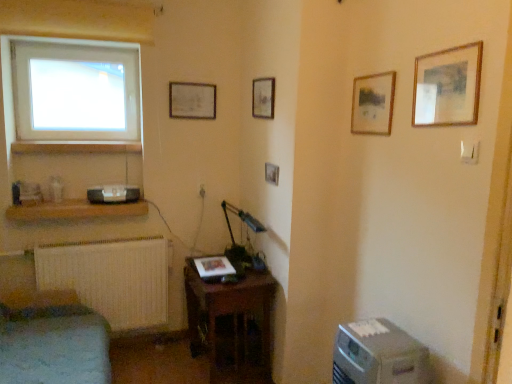
In order to face metallic gray table lamp at lower center, should I rotate leftwards or rightwards?

To align with it, rotate left about 1.421°.

This screenshot has width=512, height=384. What do you see at coordinates (241, 220) in the screenshot?
I see `metallic gray table lamp at lower center` at bounding box center [241, 220].

What do you see at coordinates (113, 194) in the screenshot?
I see `matte black speaker at lower left` at bounding box center [113, 194].

This screenshot has height=384, width=512. I want to click on wooden picture frame at upper right, the 5th picture frame from the back, so click(x=447, y=86).

At what (x,y) coordinates should I click in order to perform the action: click on white matte radiator at lower left. Please return your answer as a coordinate pair (x, y). This screenshot has height=384, width=512. Looking at the image, I should click on (111, 278).

Where is `wooden shelf at lower left, the 2th shelf in the top-to-bottom sequence`? This screenshot has width=512, height=384. wooden shelf at lower left, the 2th shelf in the top-to-bottom sequence is located at coordinates (75, 210).

Where is `transparent glass window at upper left`? transparent glass window at upper left is located at coordinates (75, 91).

I want to click on white plastic electric outlet at center, so click(202, 191).

From a real-world perspective, does metallic gray desktop computer at lower right stand above white plastic electric outlet at center?

No, from a real-world perspective, metallic gray desktop computer at lower right is not above white plastic electric outlet at center.

In the image, is metallic gray desktop computer at lower right positioned in front of or behind white plastic electric outlet at center?

metallic gray desktop computer at lower right is positioned closer to the viewer than white plastic electric outlet at center.

Considering the sizes of objects metallic gray desktop computer at lower right and white plastic electric outlet at center in the image provided, who is taller, metallic gray desktop computer at lower right or white plastic electric outlet at center?

With more height is metallic gray desktop computer at lower right.

Are metallic gray desktop computer at lower right and white plastic electric outlet at center making contact?

No, metallic gray desktop computer at lower right is not making contact with white plastic electric outlet at center.

Can you confirm if wooden picture frame at center, arranged as the 4th picture frame when viewed from the front, is bigger than wooden shelf at lower left, the 2th shelf in the top-to-bottom sequence?

Actually, wooden picture frame at center, arranged as the 4th picture frame when viewed from the front, might be smaller than wooden shelf at lower left, the 2th shelf in the top-to-bottom sequence.

Is wooden shelf at lower left, the 2th shelf in the top-to-bottom sequence, located within wooden picture frame at center, the second picture frame when ordered from back to front?

Definitely not — wooden shelf at lower left, the 2th shelf in the top-to-bottom sequence, is not inside wooden picture frame at center, the second picture frame when ordered from back to front.

Considering the positions of point (257, 105) and point (132, 204), is point (257, 105) closer or farther from the camera than point (132, 204)?

Point (257, 105) is positioned closer to the camera compared to point (132, 204).

Is wooden picture frame at center, which is counted as the 4th picture frame, starting from the right, oriented away from wooden shelf at lower left, positioned as the first shelf in bottom-to-top order?

No.

Is matte black speaker at lower left with wooden picture frame at center, the third picture frame from the right?

No, matte black speaker at lower left is not next to wooden picture frame at center, the third picture frame from the right.

Is matte black speaker at lower left oriented away from wooden picture frame at center, the third picture frame when ordered from back to front?

No.

Which is less distant, [91,196] or [270,169]?

Point [91,196] is farther from the camera than point [270,169].

From the image's perspective, is matte black speaker at lower left above or below wooden picture frame at center, which is the third picture frame from front to back?

Clearly, from the image's perspective, matte black speaker at lower left is below wooden picture frame at center, which is the third picture frame from front to back.

From a real-world perspective, between wooden picture frame at center, the third picture frame when ordered from back to front, and wooden picture frame at upper right, the first picture frame viewed from the right, who is vertically higher?

wooden picture frame at upper right, the first picture frame viewed from the right, is physically above.

Considering the positions of objects wooden picture frame at center, which is the third picture frame from front to back, and wooden picture frame at upper right, the 5th picture frame from the back, in the image provided, who is more to the left, wooden picture frame at center, which is the third picture frame from front to back, or wooden picture frame at upper right, the 5th picture frame from the back,?

wooden picture frame at center, which is the third picture frame from front to back.

Is wooden picture frame at center, the 3th picture frame viewed from the left, shorter than wooden picture frame at upper right, the first picture frame viewed from the right?

Indeed, wooden picture frame at center, the 3th picture frame viewed from the left, has a lesser height compared to wooden picture frame at upper right, the first picture frame viewed from the right.

Considering the relative sizes of wooden picture frame at upper right, the 5th picture frame from the back, and white matte radiator at lower left in the image provided, is wooden picture frame at upper right, the 5th picture frame from the back, smaller than white matte radiator at lower left?

Correct, wooden picture frame at upper right, the 5th picture frame from the back, occupies less space than white matte radiator at lower left.

From a real-world perspective, between wooden picture frame at upper right, the 5th picture frame from the back, and white matte radiator at lower left, who is vertically higher?

From a 3D spatial view, wooden picture frame at upper right, the 5th picture frame from the back, is above.

Considering the relative positions of wooden picture frame at upper right, the 1th picture frame from the front, and white matte radiator at lower left in the image provided, is wooden picture frame at upper right, the 1th picture frame from the front, to the right of white matte radiator at lower left from the viewer's perspective?

Correct, you'll find wooden picture frame at upper right, the 1th picture frame from the front, to the right of white matte radiator at lower left.

From the image's perspective, between wooden picture frame at upper right, the first picture frame viewed from the right, and white matte radiator at lower left, which one is located above?

wooden picture frame at upper right, the first picture frame viewed from the right, is shown above in the image.

Which of these two, velvet green sofa at lower left or wooden shelf at lower left, positioned as the first shelf in bottom-to-top order, is bigger?

velvet green sofa at lower left is bigger.

Which is behind, point (80, 315) or point (78, 208)?

The point (78, 208) is farther from the camera.

Is velvet green sofa at lower left oriented away from wooden shelf at lower left, positioned as the first shelf in bottom-to-top order?

No, velvet green sofa at lower left's orientation is not away from wooden shelf at lower left, positioned as the first shelf in bottom-to-top order.

From a real-world perspective, is velvet green sofa at lower left physically located above or below wooden shelf at lower left, positioned as the first shelf in bottom-to-top order?

Clearly, from a real-world perspective, velvet green sofa at lower left is below wooden shelf at lower left, positioned as the first shelf in bottom-to-top order.

Is white matte radiator at lower left behind wooden framed picture at upper right, the 4th picture frame when ordered from back to front?

Yes, white matte radiator at lower left is further from the camera.

Is white matte radiator at lower left at the right side of wooden framed picture at upper right, the 4th picture frame when ordered from back to front?

No.

Is white matte radiator at lower left facing away from wooden framed picture at upper right, the 4th picture frame when ordered from back to front?

No, white matte radiator at lower left is not facing away from wooden framed picture at upper right, the 4th picture frame when ordered from back to front.

How different are the orientations of white matte radiator at lower left and wooden framed picture at upper right, the 4th picture frame when ordered from back to front, in degrees?

92.2 degrees separate the facing orientations of white matte radiator at lower left and wooden framed picture at upper right, the 4th picture frame when ordered from back to front.

Image resolution: width=512 pixels, height=384 pixels. I want to click on desktop computer below the white plastic electric outlet at center (from a real-world perspective), so point(378,355).

Where is `the 2nd picture frame to the right of the wooden shelf at lower left, the 2th shelf in the top-to-bottom sequence, counting from the anchor's position`? The image size is (512, 384). the 2nd picture frame to the right of the wooden shelf at lower left, the 2th shelf in the top-to-bottom sequence, counting from the anchor's position is located at coordinates (263, 98).

Estimate the real-world distances between objects in this image. Which object is further from wooden picture frame at center, the third picture frame from the right, white plastic electric outlet at center or transparent glass window at upper left?

transparent glass window at upper left is positioned further to the anchor wooden picture frame at center, the third picture frame from the right.

Looking at the image, which one is located closer to wooden framed picture at upper right, which is the second picture frame in front-to-back order, wooden picture frame at upper right, the first picture frame viewed from the right, or white matte radiator at lower left?

The object closer to wooden framed picture at upper right, which is the second picture frame in front-to-back order, is wooden picture frame at upper right, the first picture frame viewed from the right.

From the picture: Which object lies nearer to the anchor point wooden picture frame at center, the 3th picture frame viewed from the left, wooden shelf at lower left, which appears as the second shelf when ordered from the bottom, or velvet green sofa at lower left?

wooden shelf at lower left, which appears as the second shelf when ordered from the bottom, is closer to wooden picture frame at center, the 3th picture frame viewed from the left.

When comparing their distances from matte wooden picture frame at upper center, arranged as the 1th picture frame when viewed from the left, does velvet green sofa at lower left or metallic gray table lamp at lower center seem further?

velvet green sofa at lower left is positioned further to the anchor matte wooden picture frame at upper center, arranged as the 1th picture frame when viewed from the left.

When comparing their distances from white matte radiator at lower left, does transparent glass window at upper left or matte black speaker at lower left seem further?

transparent glass window at upper left is further to white matte radiator at lower left.

When comparing their distances from wooden framed picture at upper right, which is the second picture frame in front-to-back order, does velvet green sofa at lower left or matte black speaker at lower left seem further?

velvet green sofa at lower left.

From the picture: Which object lies further to the anchor point matte black speaker at lower left, matte wooden picture frame at upper center, which ranks as the fifth picture frame in front-to-back order, or wooden picture frame at center, the second picture frame when ordered from back to front?

Based on the image, wooden picture frame at center, the second picture frame when ordered from back to front, appears to be further to matte black speaker at lower left.

Based on their spatial positions, is wooden shelf at lower left, which appears as the first shelf when viewed from the top, or wooden shelf at lower left, the 2th shelf in the top-to-bottom sequence, closer to velvet green sofa at lower left?

Among the two, wooden shelf at lower left, the 2th shelf in the top-to-bottom sequence, is located nearer to velvet green sofa at lower left.

Image resolution: width=512 pixels, height=384 pixels. Identify the location of electric outlet situated between wooden shelf at lower left, which appears as the second shelf when ordered from the bottom, and wooden picture frame at upper right, the first picture frame viewed from the right, from left to right. (202, 191).

Where is `electric outlet situated between matte black speaker at lower left and wooden framed picture at upper right, which is the second picture frame in front-to-back order, from left to right`? electric outlet situated between matte black speaker at lower left and wooden framed picture at upper right, which is the second picture frame in front-to-back order, from left to right is located at coordinates (202, 191).

Locate an element on the screen. Image resolution: width=512 pixels, height=384 pixels. picture frame located between wooden shelf at lower left, which appears as the first shelf when viewed from the top, and wooden picture frame at center, arranged as the 4th picture frame when viewed from the front, in the left-right direction is located at coordinates (192, 100).

The image size is (512, 384). In order to click on appliance between metallic gray desktop computer at lower right and matte wooden picture frame at upper center, which ranks as the fifth picture frame in front-to-back order, along the z-axis in this screenshot , I will do `click(113, 194)`.